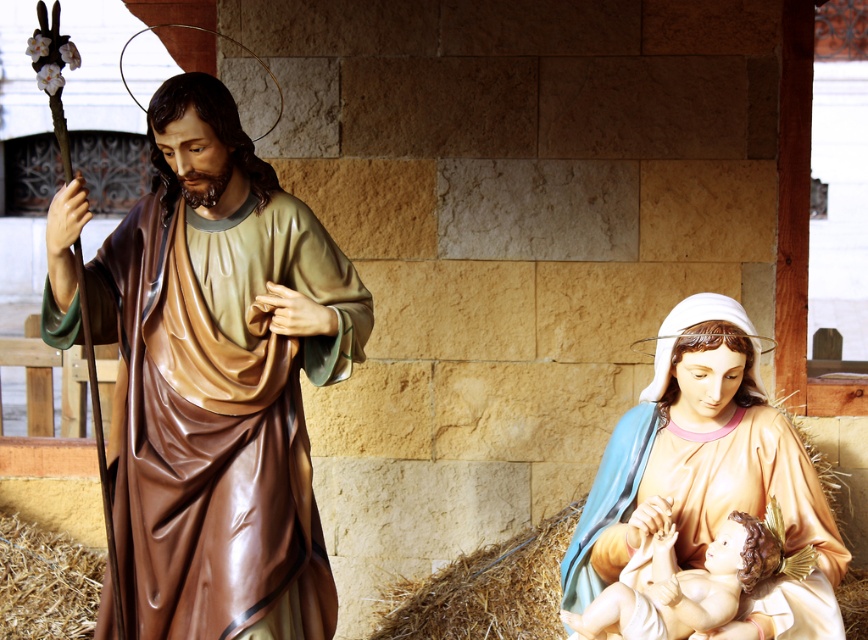
Who is lower down, matte peach statue at lower right or smooth porcelain baby at center?

smooth porcelain baby at center

Measure the distance between matte peach statue at lower right and camera.

matte peach statue at lower right and camera are 6.70 meters apart from each other.

At what (x,y) coordinates should I click in order to perform the action: click on matte peach statue at lower right. Please return your answer as a coordinate pair (x, y). The image size is (868, 640). Looking at the image, I should click on (707, 468).

Consider the image. Does brown glossy robe at left lie behind matte peach statue at lower right?

Yes, brown glossy robe at left is further from the viewer.

I want to click on brown glossy robe at left, so click(x=219, y=380).

The height and width of the screenshot is (640, 868). What are the coordinates of `brown glossy robe at left` in the screenshot? It's located at (219, 380).

From the picture: Does brown glossy robe at left appear on the left side of smooth porcelain baby at center?

Indeed, brown glossy robe at left is positioned on the left side of smooth porcelain baby at center.

Is brown glossy robe at left taller than smooth porcelain baby at center?

Yes, brown glossy robe at left is taller than smooth porcelain baby at center.

Is point (194, 262) positioned behind point (663, 557)?

That is True.

The image size is (868, 640). I want to click on brown glossy robe at left, so click(x=219, y=380).